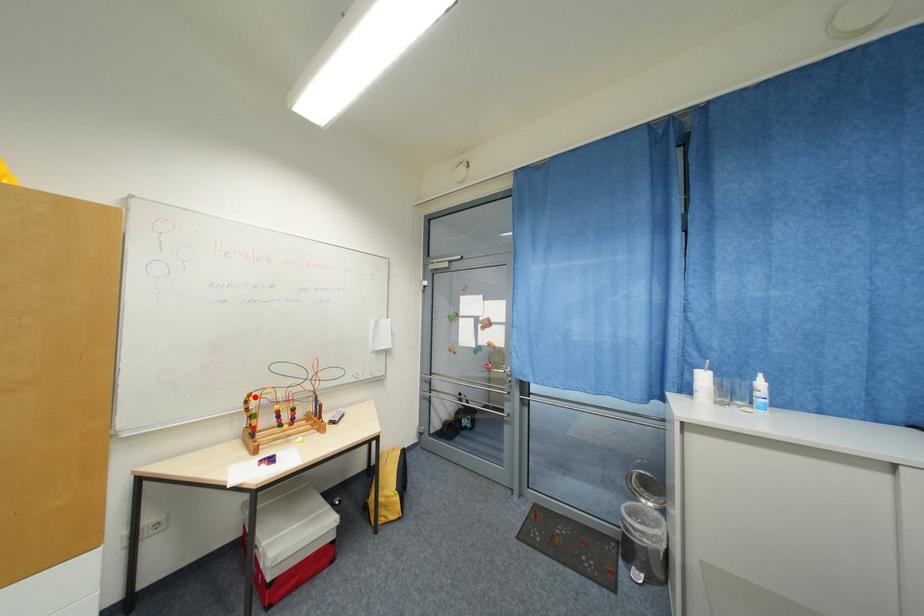
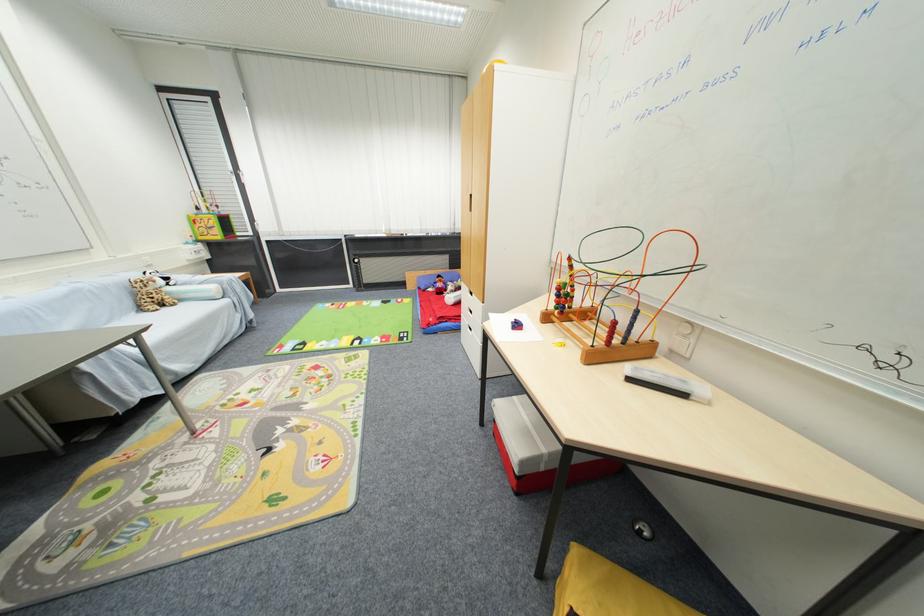
In the second image, find the point that corresponds to the highlighted location in the first image.

(575, 261)